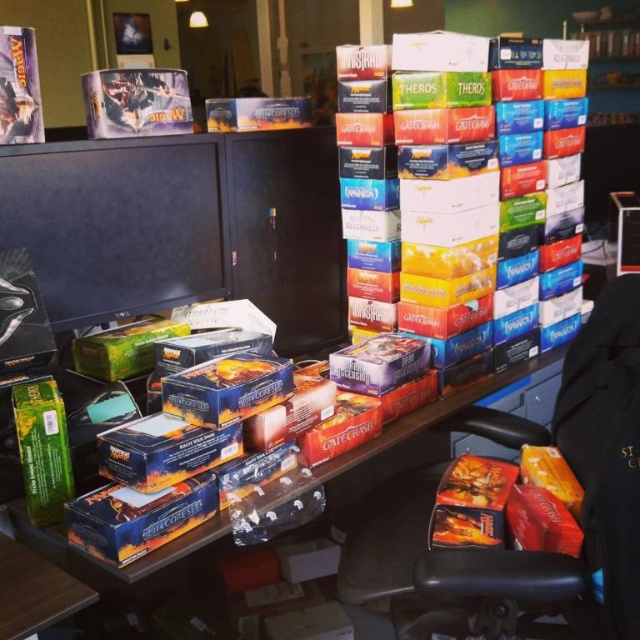
Question: Which point appears farthest from the camera in this image?

Choices:
 (A) (417, 572)
 (B) (145, 570)

Answer: (A)

Question: Considering the relative positions of black plastic swivel chair at lower right and matte cardboard boxes at center in the image provided, where is black plastic swivel chair at lower right located with respect to matte cardboard boxes at center?

Choices:
 (A) right
 (B) left

Answer: (A)

Question: Which point appears closest to the camera in this image?

Choices:
 (A) (477, 596)
 (B) (17, 552)

Answer: (B)

Question: Which point appears farthest from the camera in this image?

Choices:
 (A) (632, 422)
 (B) (54, 584)

Answer: (A)

Question: Is the position of black plastic swivel chair at lower right less distant than that of matte cardboard boxes at center?

Choices:
 (A) yes
 (B) no

Answer: (B)

Question: Is black plastic swivel chair at lower right closer to the viewer compared to matte cardboard boxes at center?

Choices:
 (A) yes
 (B) no

Answer: (B)